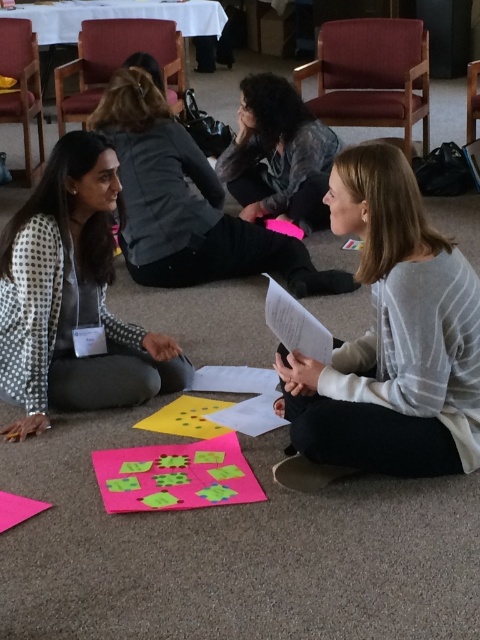
Question: Considering the relative positions of white dotted blazer at left and matte gray sweater at center in the image provided, where is white dotted blazer at left located with respect to matte gray sweater at center?

Choices:
 (A) right
 (B) left

Answer: (B)

Question: Is white dotted blazer at left below matte gray sweater at center?

Choices:
 (A) yes
 (B) no

Answer: (A)

Question: Which object is positioned farthest from the dark gray sweater at center?

Choices:
 (A) white dotted blazer at left
 (B) gray striped sweater at center

Answer: (B)

Question: Is gray striped sweater at center smaller than matte gray sweater at center?

Choices:
 (A) no
 (B) yes

Answer: (B)

Question: Which point is farther to the camera?

Choices:
 (A) (311, 124)
 (B) (67, 364)
 (C) (179, 150)
 (D) (331, 476)

Answer: (A)

Question: Among these points, which one is farthest from the camera?

Choices:
 (A) (322, 476)
 (B) (7, 355)
 (C) (197, 256)

Answer: (C)